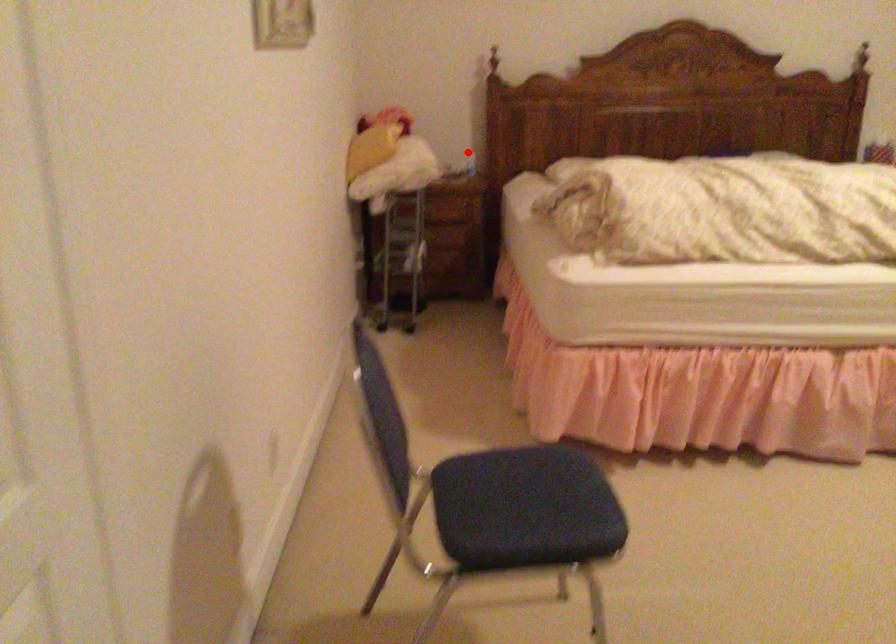
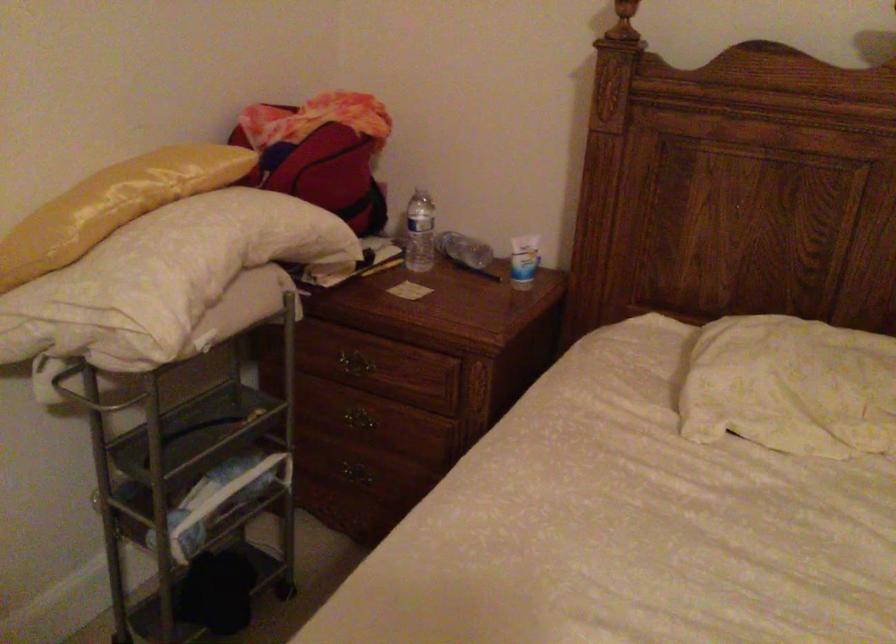
Where in the second image is the point corresponding to the highlighted location from the first image?

(523, 261)